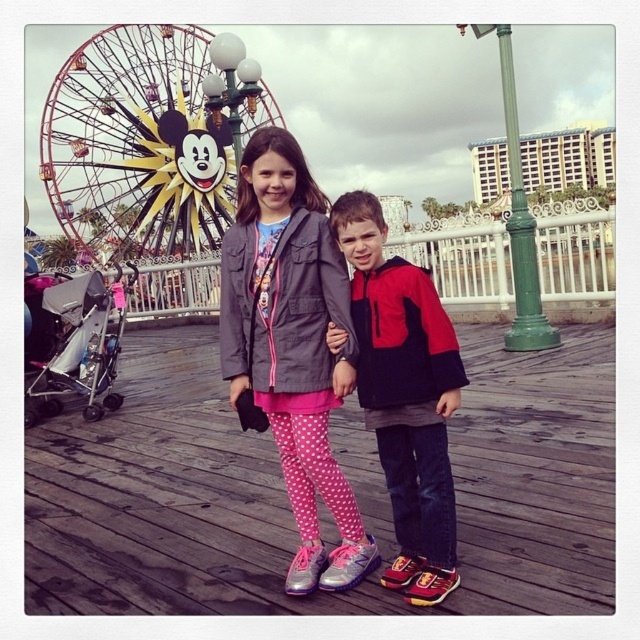
Which is above, pink fabric pants at center or metallic ferris wheel at upper left?

metallic ferris wheel at upper left is higher up.

Does point (355, 448) lie in front of point (189, 182)?

Yes, it is in front of point (189, 182).

Locate an element on the screen. pink fabric pants at center is located at coordinates [x=285, y=499].

Does pink fabric pants at center lie behind pink polka dot leggings at center?

That is False.

Which is more to the right, pink fabric pants at center or pink polka dot leggings at center?

pink fabric pants at center

Is point (140, 573) more distant than point (355, 531)?

No, it is not.

Locate an element on the screen. The image size is (640, 640). pink fabric pants at center is located at coordinates (285, 499).

Is pink polka dot leggings at center shorter than red/black jacket at center?

In fact, pink polka dot leggings at center may be taller than red/black jacket at center.

Who is shorter, pink polka dot leggings at center or red/black jacket at center?

Standing shorter between the two is red/black jacket at center.

Who is more forward, (316,257) or (428,556)?

Positioned in front is point (428,556).

You are a GUI agent. You are given a task and a screenshot of the screen. Output one action in this format:
    pyautogui.click(x=<x>, y=<y>)
    Task: Click on the pink polka dot leggings at center
    
    Given the screenshot: What is the action you would take?
    (292, 346)